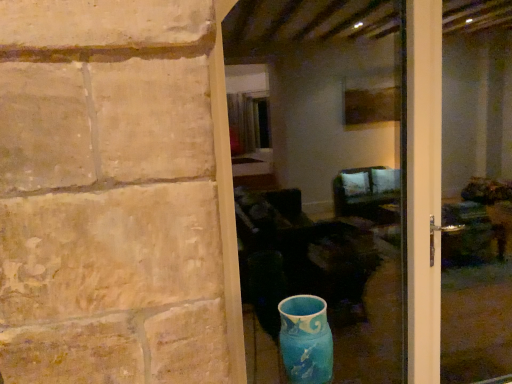
The image size is (512, 384). Describe the element at coordinates (458, 200) in the screenshot. I see `transparent glass door at center` at that location.

Identify the location of transparent glass door at center. pos(458,200).

Where is `transparent glass door at center`? The height and width of the screenshot is (384, 512). transparent glass door at center is located at coordinates (458, 200).